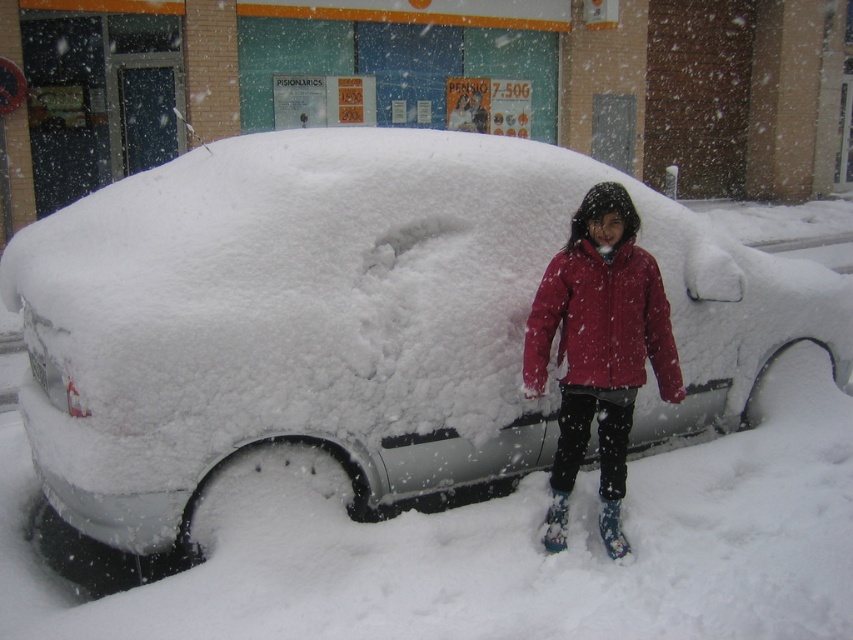
Question: Is the position of white matte car at center less distant than that of matte red jacket at center?

Choices:
 (A) yes
 (B) no

Answer: (A)

Question: From the image, what is the correct spatial relationship of red fleece jacket at center in relation to blue fabric ski boot at lower center?

Choices:
 (A) above
 (B) below

Answer: (A)

Question: Which object appears farthest from the camera in this image?

Choices:
 (A) blue rubber ski boot at lower center
 (B) red fleece jacket at center

Answer: (A)

Question: Which point appears farthest from the camera in this image?

Choices:
 (A) (631, 224)
 (B) (606, 516)

Answer: (B)

Question: Which of these objects is positioned closest to the blue rubber ski boot at lower center?

Choices:
 (A) white matte car at center
 (B) matte red jacket at center
 (C) blue fabric ski boot at lower center
 (D) red fleece jacket at center

Answer: (C)

Question: Can you confirm if white matte car at center is thinner than matte red jacket at center?

Choices:
 (A) no
 (B) yes

Answer: (A)